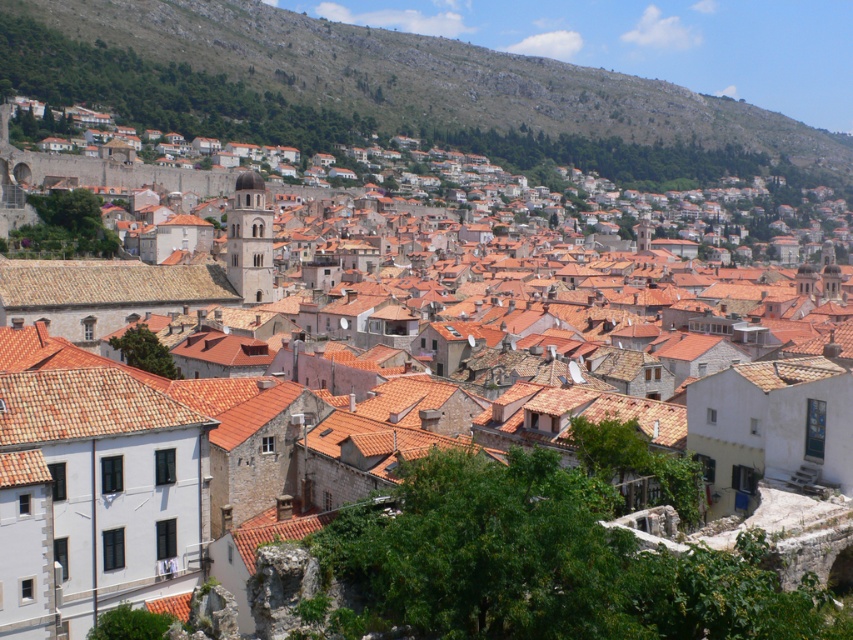
Question: Based on their relative distances, which object is nearer to the terracotta tiled roof at lower left?

Choices:
 (A) green grassy hillside at upper left
 (B) brown tile roof at center

Answer: (B)

Question: Which point is farther to the camera?

Choices:
 (A) (109, 262)
 (B) (207, 26)

Answer: (B)

Question: Among these points, which one is farthest from the camera?

Choices:
 (A) (138, 33)
 (B) (119, 275)
 (C) (99, 419)

Answer: (A)

Question: Does green grassy hillside at upper left appear over terracotta tiled roof at lower left?

Choices:
 (A) no
 (B) yes

Answer: (B)

Question: Can you confirm if green grassy hillside at upper left is thinner than terracotta tiled roof at lower left?

Choices:
 (A) yes
 (B) no

Answer: (B)

Question: Considering the relative positions of green grassy hillside at upper left and terracotta tiled roof at lower left in the image provided, where is green grassy hillside at upper left located with respect to terracotta tiled roof at lower left?

Choices:
 (A) above
 (B) below

Answer: (A)